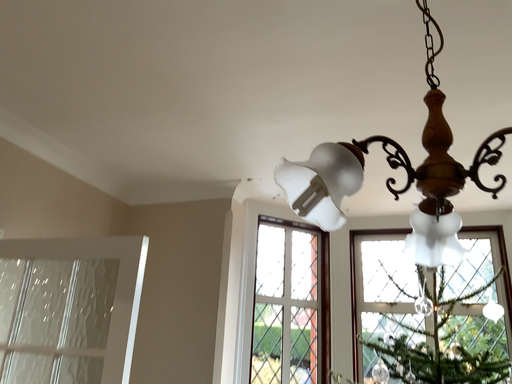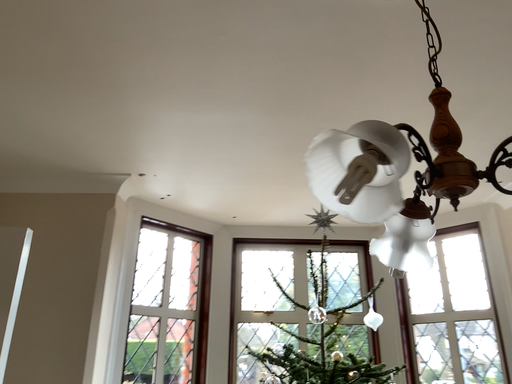
Question: Which way did the camera rotate in the video?

Choices:
 (A) rotated left
 (B) rotated right

Answer: (B)